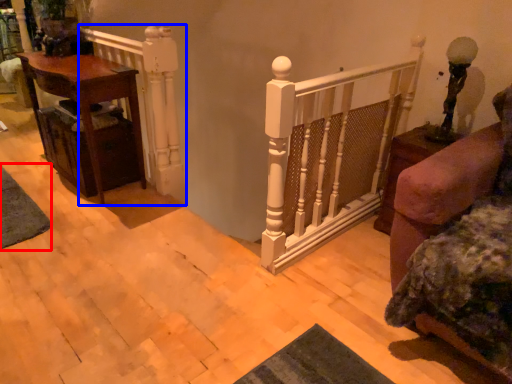
Question: Which of the following is the farthest to the observer, mat (highlighted by a red box) or rail (highlighted by a blue box)?

Choices:
 (A) mat
 (B) rail

Answer: (A)